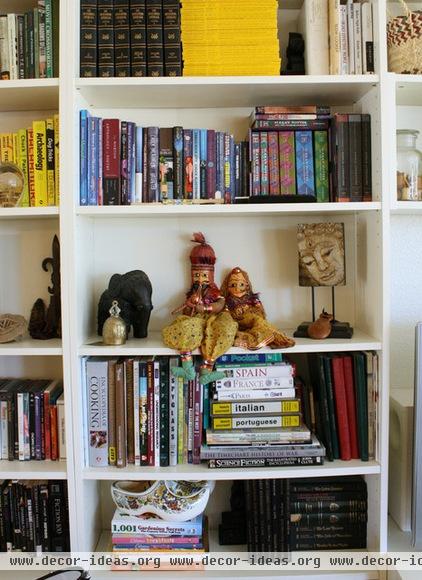
I want to click on books on top shelf of bookcase on the left, so click(x=49, y=37), click(x=43, y=41), click(x=36, y=50), click(x=31, y=60), click(x=27, y=67), click(x=21, y=70), click(x=13, y=70), click(x=6, y=72).